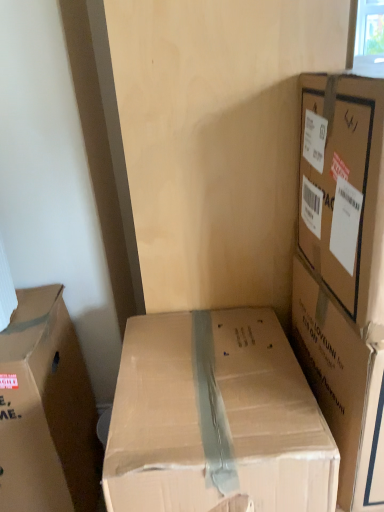
Question: Is brown cardboard box at left, the third box viewed from the right, facing away from brown cardboard box at upper right, the first box positioned from the right?

Choices:
 (A) no
 (B) yes

Answer: (A)

Question: Can brown cardboard box at upper right, which ranks as the third box in left-to-right order, be found inside brown cardboard box at left, the third box viewed from the right?

Choices:
 (A) yes
 (B) no

Answer: (B)

Question: From the image's perspective, is brown cardboard box at left, the third box viewed from the right, below brown cardboard box at upper right, which ranks as the third box in left-to-right order?

Choices:
 (A) yes
 (B) no

Answer: (A)

Question: Is brown cardboard box at left, the third box viewed from the right, aimed at brown cardboard box at upper right, the first box positioned from the right?

Choices:
 (A) no
 (B) yes

Answer: (A)

Question: Is brown cardboard box at left, which appears as the 1th box when viewed from the left, not within brown cardboard box at upper right, the first box positioned from the right?

Choices:
 (A) no
 (B) yes

Answer: (B)

Question: Can you confirm if brown cardboard box at left, which appears as the 1th box when viewed from the left, is shorter than brown cardboard box at upper right, the first box positioned from the right?

Choices:
 (A) no
 (B) yes

Answer: (A)

Question: Considering the relative positions of brown cardboard box at left, which appears as the 1th box when viewed from the left, and brown cardboard box at center, the second box viewed from the right, in the image provided, is brown cardboard box at left, which appears as the 1th box when viewed from the left, to the left of brown cardboard box at center, the second box viewed from the right, from the viewer's perspective?

Choices:
 (A) no
 (B) yes

Answer: (B)

Question: Is brown cardboard box at left, which appears as the 1th box when viewed from the left, facing towards brown cardboard box at center, the second box viewed from the left?

Choices:
 (A) yes
 (B) no

Answer: (B)

Question: Does brown cardboard box at left, which appears as the 1th box when viewed from the left, come in front of brown cardboard box at center, the second box viewed from the right?

Choices:
 (A) yes
 (B) no

Answer: (B)

Question: Is brown cardboard box at left, the third box viewed from the right, shorter than brown cardboard box at center, the second box viewed from the right?

Choices:
 (A) yes
 (B) no

Answer: (A)

Question: Is brown cardboard box at left, which appears as the 1th box when viewed from the left, taller than brown cardboard box at center, the second box viewed from the right?

Choices:
 (A) yes
 (B) no

Answer: (B)

Question: From a real-world perspective, is brown cardboard box at left, which appears as the 1th box when viewed from the left, positioned over brown cardboard box at center, the second box viewed from the left, based on gravity?

Choices:
 (A) no
 (B) yes

Answer: (B)

Question: Is brown cardboard box at center, the second box viewed from the left, positioned with its back to brown cardboard box at left, the third box viewed from the right?

Choices:
 (A) yes
 (B) no

Answer: (B)